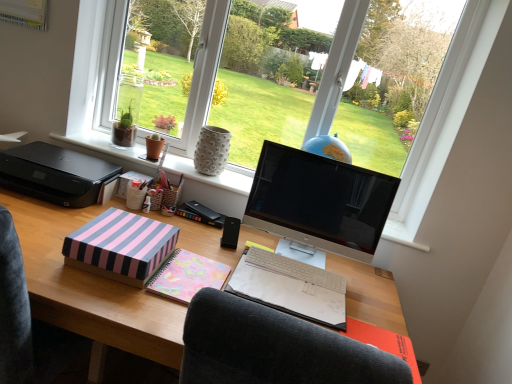
Locate an element on the screen. The width and height of the screenshot is (512, 384). vacant space underneath sleek black monitor at center (from a real-world perspective) is located at coordinates (292, 251).